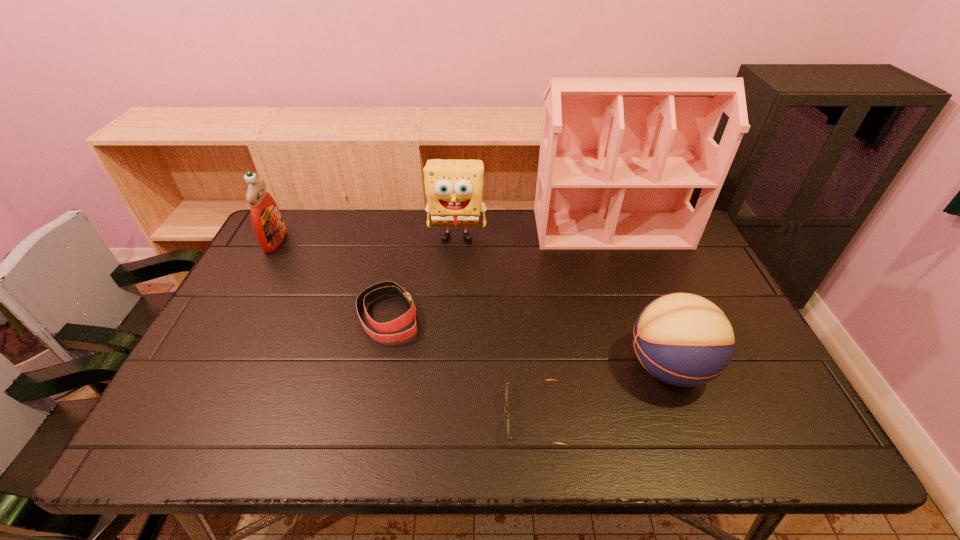
Identify the location of free point between the tallest object and the leftmost object. (443, 235).

What are the coordinates of `free space between the fifth tallest object and the third shortest object` in the screenshot? It's located at (528, 341).

Where is `empty space that is in between the basketball and the dollhouse`? This screenshot has width=960, height=540. empty space that is in between the basketball and the dollhouse is located at coordinates (639, 298).

At what (x,y) coordinates should I click in order to perform the action: click on free space between the shortest object and the dog collar. Please return your answer as a coordinate pair (x, y). Image resolution: width=960 pixels, height=540 pixels. Looking at the image, I should click on (462, 367).

You are a GUI agent. You are given a task and a screenshot of the screen. Output one action in this format:
    pyautogui.click(x=<x>, y=<y>)
    Task: Click on the free space between the fifth tallest object and the third shortest object
    The height and width of the screenshot is (540, 960).
    Given the screenshot: What is the action you would take?
    pyautogui.click(x=528, y=341)

The image size is (960, 540). I want to click on free space between the detergent and the dog collar, so click(x=331, y=278).

This screenshot has width=960, height=540. In order to click on vacant area that lies between the fourth tallest object and the fifth tallest object in this screenshot , I will do `click(528, 341)`.

This screenshot has width=960, height=540. Find the location of `vacant space that's between the tallest object and the detergent`. vacant space that's between the tallest object and the detergent is located at coordinates (443, 235).

You are a GUI agent. You are given a task and a screenshot of the screen. Output one action in this format:
    pyautogui.click(x=<x>, y=<y>)
    Task: Click on the free space between the second shortest object and the sponge
    This screenshot has height=540, width=960.
    Given the screenshot: What is the action you would take?
    pyautogui.click(x=422, y=275)

Locate an element on the screen. Image resolution: width=960 pixels, height=540 pixels. vacant area between the sponge and the dog collar is located at coordinates (422, 275).